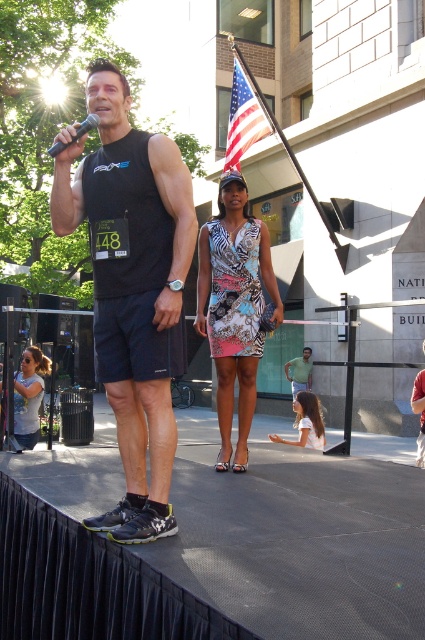
Image resolution: width=425 pixels, height=640 pixels. What do you see at coordinates (243, 120) in the screenshot? I see `american flag at upper center` at bounding box center [243, 120].

Measure the distance between american flag at upper center and camera.

american flag at upper center and camera are 13.32 meters apart from each other.

Locate an element on the screen. The image size is (425, 640). american flag at upper center is located at coordinates [243, 120].

Does printed fabric dress at center have a lesser width compared to matte gray tank top at lower left?

No, printed fabric dress at center is not thinner than matte gray tank top at lower left.

Is printed fabric dress at center above matte gray tank top at lower left?

Yes.

Measure the distance between printed fabric dress at center and camera.

printed fabric dress at center and camera are 4.32 meters apart from each other.

This screenshot has height=640, width=425. Identify the location of printed fabric dress at center. (234, 307).

Between point (268, 237) and point (226, 140), which one is positioned in front?

Point (268, 237)

Is point (209, 339) farther from viewer compared to point (252, 92)?

No.

Where is `printed fabric dress at center`? The height and width of the screenshot is (640, 425). printed fabric dress at center is located at coordinates (234, 307).